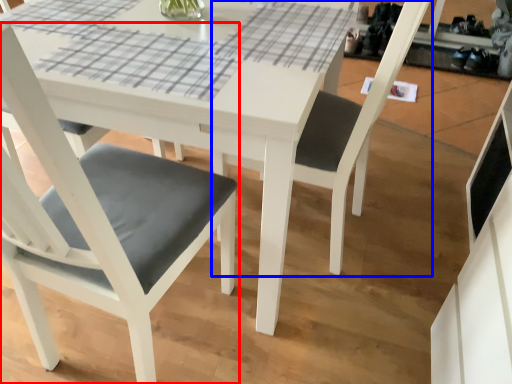
Question: Among these objects, which one is farthest to the camera, chair (highlighted by a red box) or chair (highlighted by a blue box)?

Choices:
 (A) chair
 (B) chair

Answer: (B)